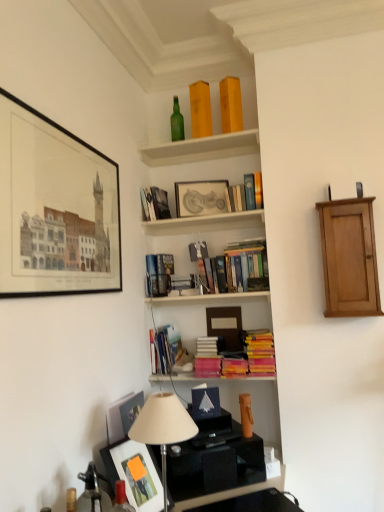
Where is `empty space that is in between matte yellow book at upper center, which ranks as the tenth book in bottom-to-top order, and green glass bottle at upper center`? The image size is (384, 512). empty space that is in between matte yellow book at upper center, which ranks as the tenth book in bottom-to-top order, and green glass bottle at upper center is located at coordinates (203, 146).